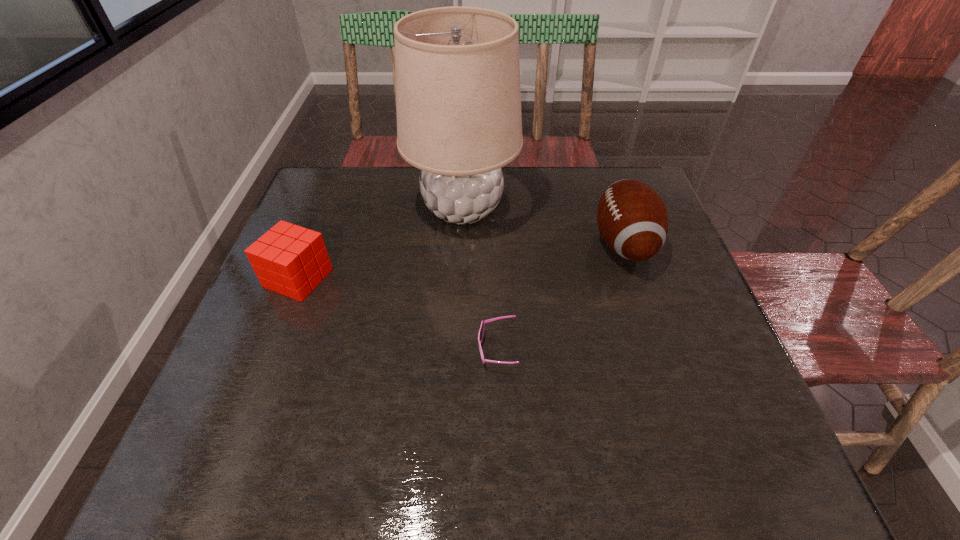
Where is `vacant point located on the laces of the second tallest object`? vacant point located on the laces of the second tallest object is located at coordinates (453, 244).

Identify the location of vacant space located on the front of the third tallest object. This screenshot has width=960, height=540. click(x=221, y=474).

This screenshot has width=960, height=540. Identify the location of vacant space located 0.230m on the front-facing side of the nearest object. (367, 349).

Identify the location of vacant space situated on the front-facing side of the nearest object. Image resolution: width=960 pixels, height=540 pixels. (435, 349).

Locate an element on the screen. vacant space located 0.120m on the front-facing side of the nearest object is located at coordinates (420, 349).

Image resolution: width=960 pixels, height=540 pixels. I want to click on lampshade at the far edge, so click(x=458, y=99).

Where is `football that is at the far edge`? football that is at the far edge is located at coordinates (632, 218).

I want to click on object that is at the left edge, so click(289, 259).

Find the location of `object at the right edge`. object at the right edge is located at coordinates (632, 218).

The height and width of the screenshot is (540, 960). In order to click on object at the far right corner in this screenshot , I will do `click(632, 218)`.